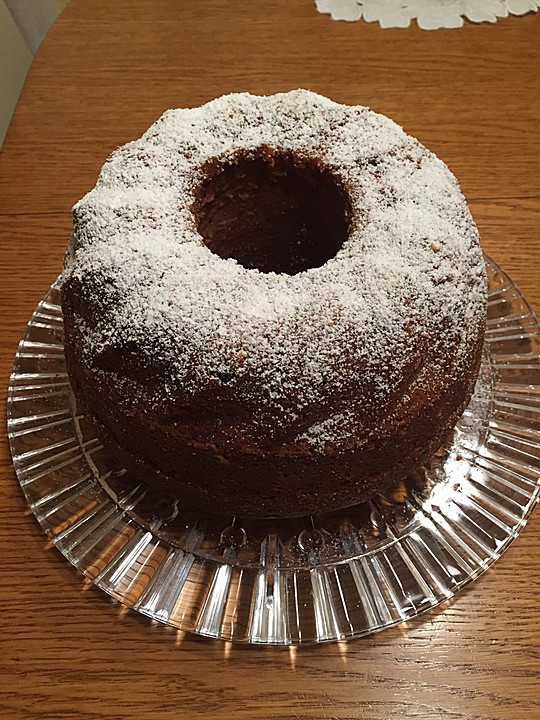
Identify the location of space to left of table. (12, 52).